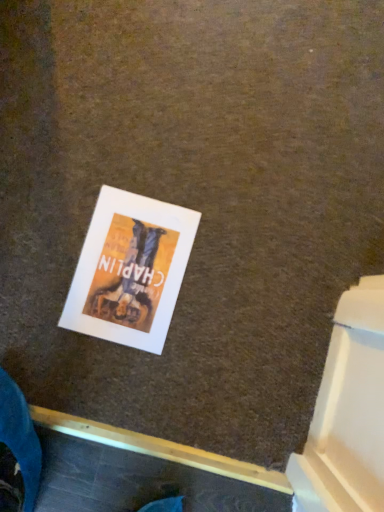
You are a GUI agent. You are given a task and a screenshot of the screen. Output one action in this format:
    pyautogui.click(x=<x>, y=<y>)
    Task: Click on the blank space situated above matte paper poster at center (from a real-world perspective)
    This screenshot has width=384, height=512.
    Given the screenshot: What is the action you would take?
    pyautogui.click(x=128, y=272)